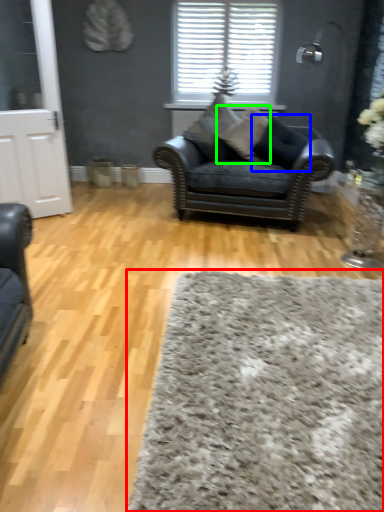
Question: Which is nearer to the plain (highlighted by a red box)? pillow (highlighted by a blue box) or pillow (highlighted by a green box).

Choices:
 (A) pillow
 (B) pillow

Answer: (A)